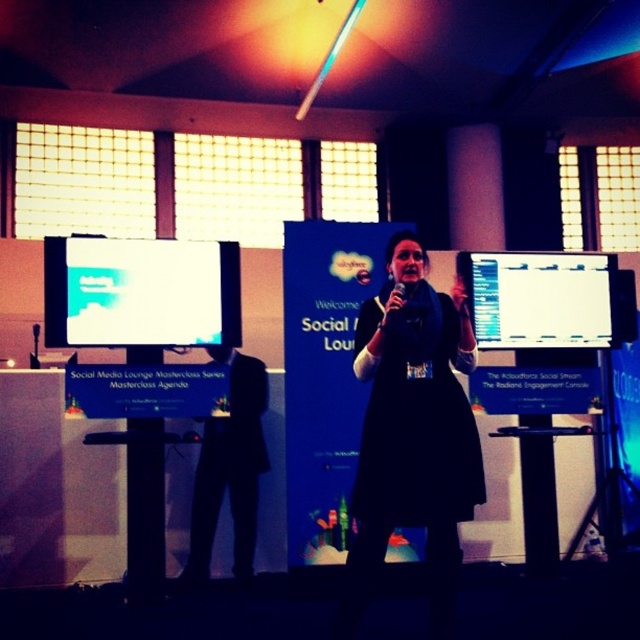
Question: Which object is positioned closest to the white glossy projector screen at left?

Choices:
 (A) black matte dress at center
 (B) white glossy monitor at center

Answer: (A)

Question: Is black matte dress at center to the left of black suit at center from the viewer's perspective?

Choices:
 (A) no
 (B) yes

Answer: (A)

Question: Can you confirm if white glossy projector screen at left is positioned to the right of white glossy monitor at center?

Choices:
 (A) no
 (B) yes

Answer: (A)

Question: Considering the relative positions of black matte dress at center and white glossy projector screen at left in the image provided, where is black matte dress at center located with respect to white glossy projector screen at left?

Choices:
 (A) below
 (B) above

Answer: (A)

Question: Which object is the farthest from the black matte dress at center?

Choices:
 (A) black suit at center
 (B) white glossy projector screen at left
 (C) white glossy monitor at center

Answer: (A)

Question: Which is farther from the white glossy monitor at center?

Choices:
 (A) white glossy projector screen at left
 (B) black matte dress at center
 (C) black suit at center

Answer: (A)